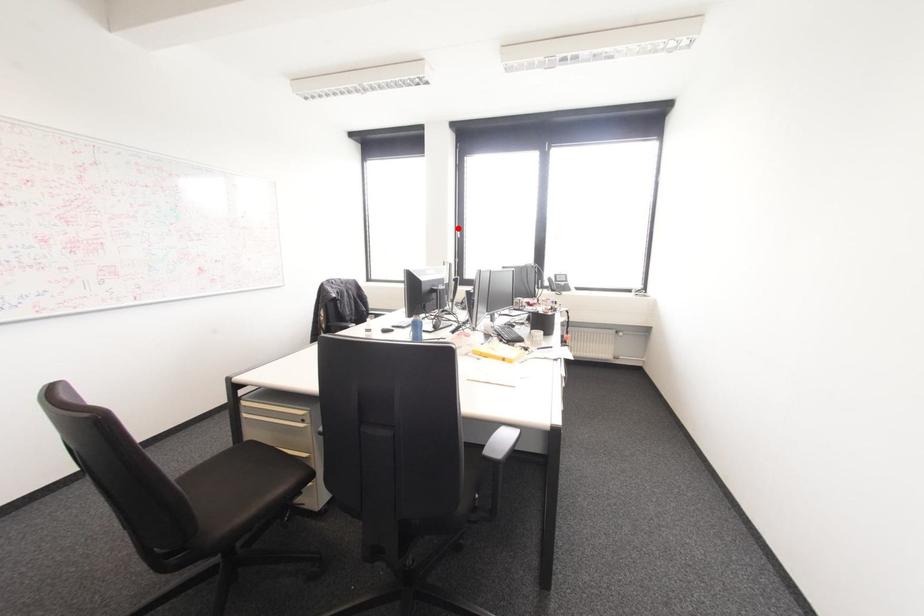
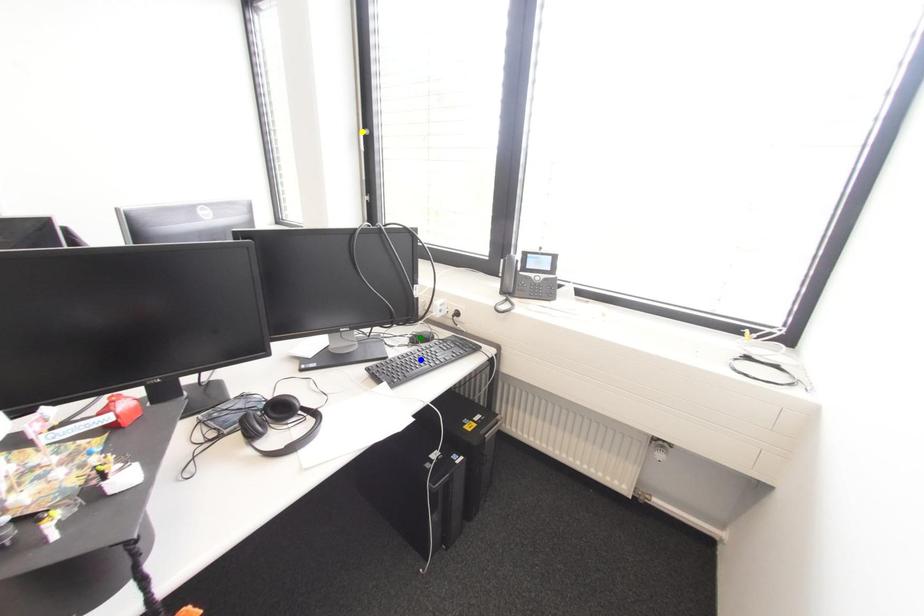
Question: I am providing you with two images of the same scene from different viewpoints. A red point is marked on the first image. You are given multiple points on the second image. Which mark in image 2 goes with the point in image 1?

Choices:
 (A) blue point
 (B) yellow point
 (C) green point

Answer: (B)